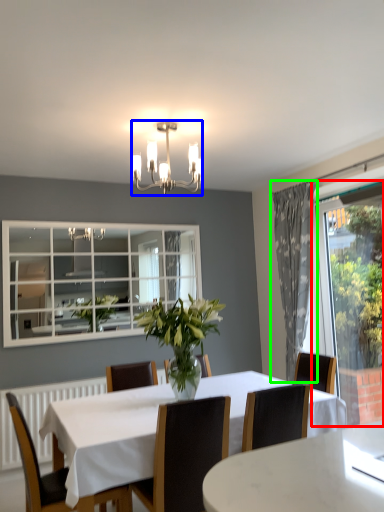
Question: Considering the real-world distances, which object is closest to window screen (highlighted by a red box)? lamp (highlighted by a blue box) or curtain (highlighted by a green box).

Choices:
 (A) lamp
 (B) curtain

Answer: (B)